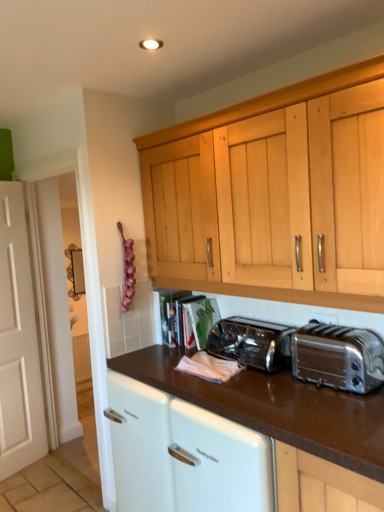
Question: Is satin silver toaster at center, marked as the second toaster in a front-to-back arrangement, wider than silver metallic toaster at right, which is the first toaster in front-to-back order?

Choices:
 (A) yes
 (B) no

Answer: (A)

Question: From a real-world perspective, is satin silver toaster at center, marked as the second toaster in a front-to-back arrangement, on silver metallic toaster at right, which is the first toaster in front-to-back order?

Choices:
 (A) no
 (B) yes

Answer: (A)

Question: Is silver metallic toaster at right, the second toaster positioned from the back, at the back of satin silver toaster at center, which is the 1th toaster from back to front?

Choices:
 (A) yes
 (B) no

Answer: (B)

Question: Is silver metallic toaster at right, which is the first toaster in front-to-back order, completely or partially inside satin silver toaster at center, which is the 1th toaster from back to front?

Choices:
 (A) no
 (B) yes

Answer: (A)

Question: From the image's perspective, is satin silver toaster at center, which is the 1th toaster from back to front, beneath silver metallic toaster at right, which is the first toaster in front-to-back order?

Choices:
 (A) no
 (B) yes

Answer: (B)

Question: Is satin silver toaster at center, marked as the second toaster in a front-to-back arrangement, outside silver metallic toaster at right, the second toaster positioned from the back?

Choices:
 (A) no
 (B) yes

Answer: (B)

Question: Does brown glossy countertop at center have a lesser width compared to satin silver toaster at center, marked as the second toaster in a front-to-back arrangement?

Choices:
 (A) yes
 (B) no

Answer: (B)

Question: Does brown glossy countertop at center have a lesser height compared to satin silver toaster at center, marked as the second toaster in a front-to-back arrangement?

Choices:
 (A) no
 (B) yes

Answer: (A)

Question: Is brown glossy countertop at center positioned with its back to satin silver toaster at center, which is the 1th toaster from back to front?

Choices:
 (A) yes
 (B) no

Answer: (B)

Question: Is the position of brown glossy countertop at center more distant than that of satin silver toaster at center, marked as the second toaster in a front-to-back arrangement?

Choices:
 (A) no
 (B) yes

Answer: (A)

Question: From a real-world perspective, is brown glossy countertop at center physically above satin silver toaster at center, marked as the second toaster in a front-to-back arrangement?

Choices:
 (A) yes
 (B) no

Answer: (B)

Question: Is satin silver toaster at center, which is the 1th toaster from back to front, surrounded by brown glossy countertop at center?

Choices:
 (A) no
 (B) yes

Answer: (A)

Question: Is silver metallic toaster at right, which is the first toaster in front-to-back order, smaller than brown glossy countertop at center?

Choices:
 (A) no
 (B) yes

Answer: (B)